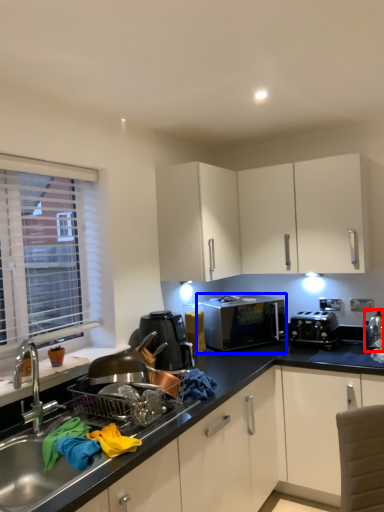
Question: Which point is closer to the camera, appliance (highlighted by a red box) or microwave oven (highlighted by a blue box)?

Choices:
 (A) appliance
 (B) microwave oven

Answer: (A)